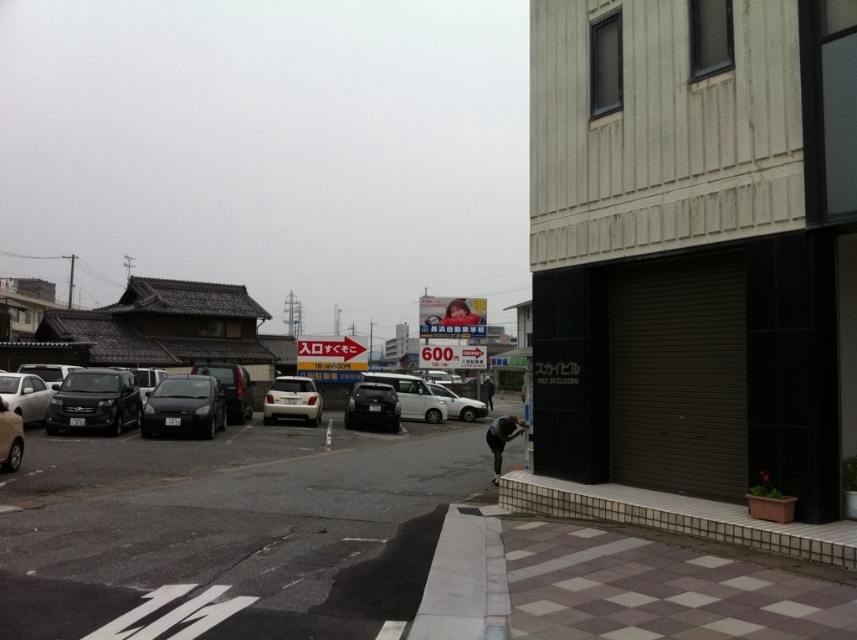
Who is lower down, shiny black sedan at center-left or white matte car at center?

white matte car at center is below.

Is shiny black sedan at center-left wider than white matte car at center?

Yes, shiny black sedan at center-left is wider than white matte car at center.

The height and width of the screenshot is (640, 857). Find the location of `shiny black sedan at center-left`. shiny black sedan at center-left is located at coordinates (231, 387).

You are a GUI agent. You are given a task and a screenshot of the screen. Output one action in this format:
    pyautogui.click(x=<x>, y=<y>)
    Task: Click on the shiny black sedan at center-left
    This screenshot has height=640, width=857.
    Given the screenshot: What is the action you would take?
    pyautogui.click(x=231, y=387)

How distant is shiny black sedan at center-left from silver metallic car at left?

shiny black sedan at center-left is 11.95 meters from silver metallic car at left.

Who is shorter, shiny black sedan at center-left or silver metallic car at left?

silver metallic car at left is shorter.

Identify the location of shiny black sedan at center-left. (231, 387).

Is point (21, 416) behind point (469, 417)?

That is False.

Is matte silver car at left bigger than white matte car at center?

No.

The height and width of the screenshot is (640, 857). In order to click on matte silver car at left in this screenshot , I will do `click(24, 396)`.

Where is `matte silver car at left`? Image resolution: width=857 pixels, height=640 pixels. matte silver car at left is located at coordinates (24, 396).